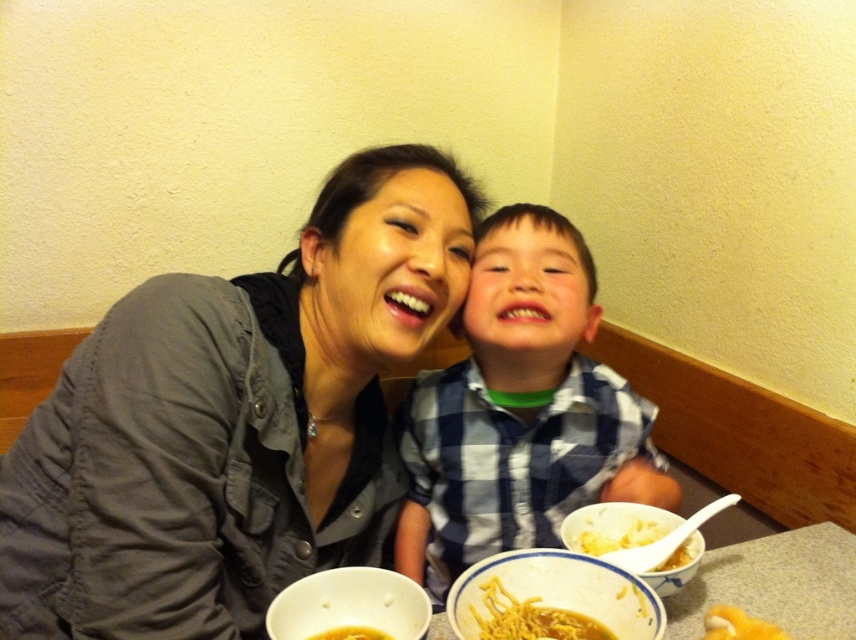
How far apart are white matte bowl at lower center and white ceramic bowl at lower right?

white matte bowl at lower center and white ceramic bowl at lower right are 12.69 inches apart.

How much distance is there between white matte bowl at lower center and white ceramic bowl at lower right?

A distance of 12.69 inches exists between white matte bowl at lower center and white ceramic bowl at lower right.

You are a GUI agent. You are given a task and a screenshot of the screen. Output one action in this format:
    pyautogui.click(x=<x>, y=<y>)
    Task: Click on the white matte bowl at lower center
    The width and height of the screenshot is (856, 640).
    Given the screenshot: What is the action you would take?
    pyautogui.click(x=349, y=604)

Is point (507, 552) positioned in front of point (602, 634)?

That is False.

Is yellow matte bowl at lower center closer to the viewer compared to yellow noodle soup at lower center?

Yes, yellow matte bowl at lower center is closer to the viewer.

Find the location of a particular element. The width and height of the screenshot is (856, 640). yellow matte bowl at lower center is located at coordinates (553, 593).

Does blue plaid shirt at center have a greater width compared to white matte bowl at lower center?

Yes.

Which is in front, point (449, 380) or point (301, 604)?

Point (301, 604)

Find the location of a particular element. The height and width of the screenshot is (640, 856). blue plaid shirt at center is located at coordinates (519, 410).